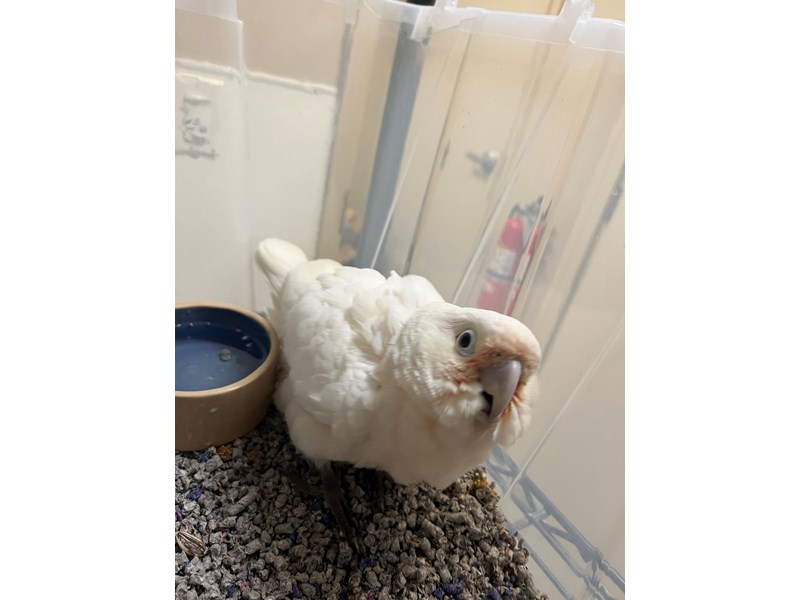
The width and height of the screenshot is (800, 600). In order to click on door handle in this screenshot , I will do `click(494, 163)`.